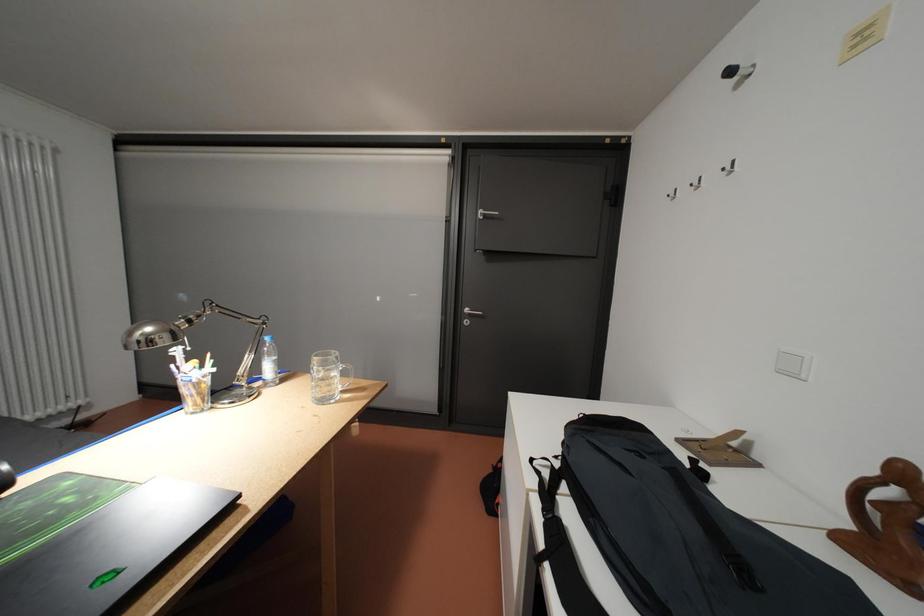
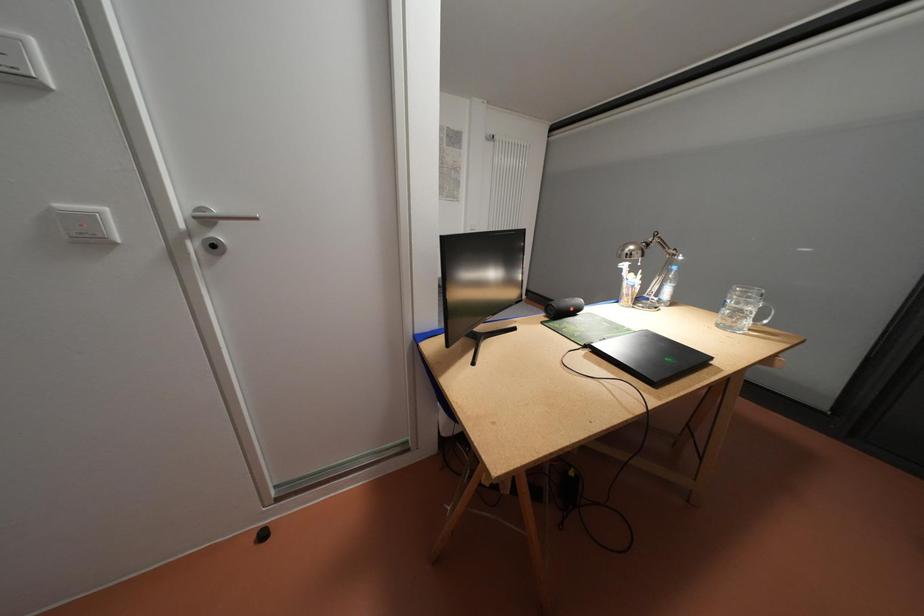
Question: The camera is either moving clockwise (left) or counter-clockwise (right) around the object. The first image is from the beginning of the video and the second image is from the end. Is the camera moving left or right when shooting the video?

Choices:
 (A) Left
 (B) Right

Answer: (B)